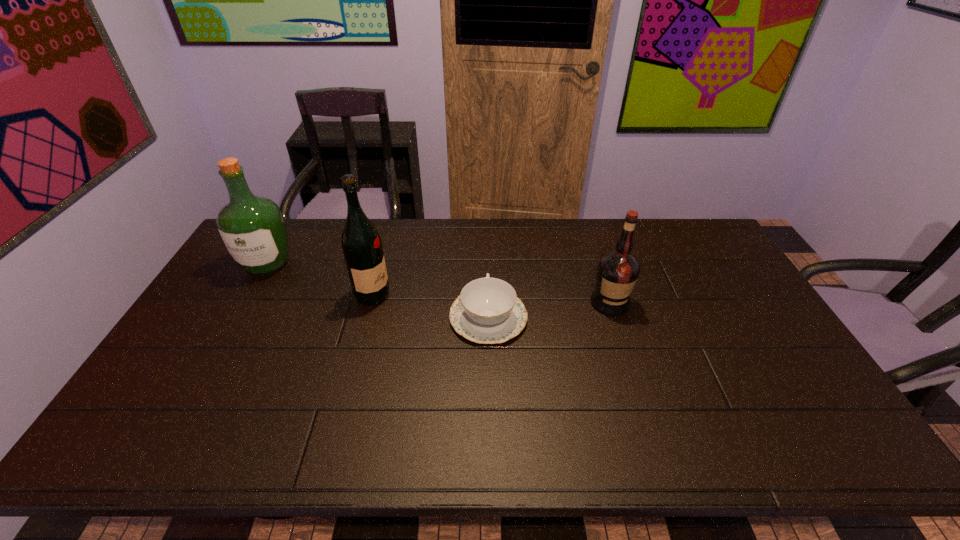
Locate an element on the screen. The height and width of the screenshot is (540, 960). the second liquor from left to right is located at coordinates (362, 247).

Locate an element on the screen. Image resolution: width=960 pixels, height=540 pixels. the leftmost liquor is located at coordinates (252, 227).

Find the location of `the farthest liquor`. the farthest liquor is located at coordinates (252, 227).

Find the location of a particular element. The width and height of the screenshot is (960, 540). the shortest liquor is located at coordinates (617, 272).

This screenshot has height=540, width=960. Identify the location of the rightmost object. (617, 272).

You are a GUI agent. You are given a task and a screenshot of the screen. Output one action in this format:
    pyautogui.click(x=<x>, y=<y>)
    Task: Click on the second object from right to left
    
    Given the screenshot: What is the action you would take?
    pyautogui.click(x=487, y=311)

What are the coordinates of `the shortest object` in the screenshot? It's located at (487, 311).

Locate an element on the screen. The image size is (960, 540). free space located on the front-facing side of the third object from right to left is located at coordinates (427, 295).

You are a GUI agent. You are given a task and a screenshot of the screen. Output one action in this format:
    pyautogui.click(x=<x>, y=<y>)
    Task: Click on the vacant space located on the front-facing side of the farthest liquor
    This screenshot has width=960, height=540.
    Given the screenshot: What is the action you would take?
    pyautogui.click(x=212, y=361)

Where is `free space located 0.350m on the surface of the rightmost object`? free space located 0.350m on the surface of the rightmost object is located at coordinates (648, 423).